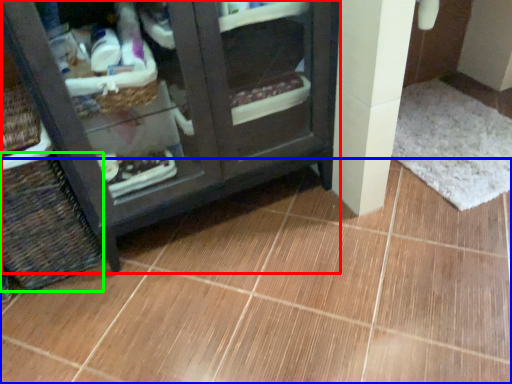
Question: Which is farther away from furniture (highlighted by a red box)? ceramic tile (highlighted by a blue box) or basket (highlighted by a green box)?

Choices:
 (A) ceramic tile
 (B) basket

Answer: (A)